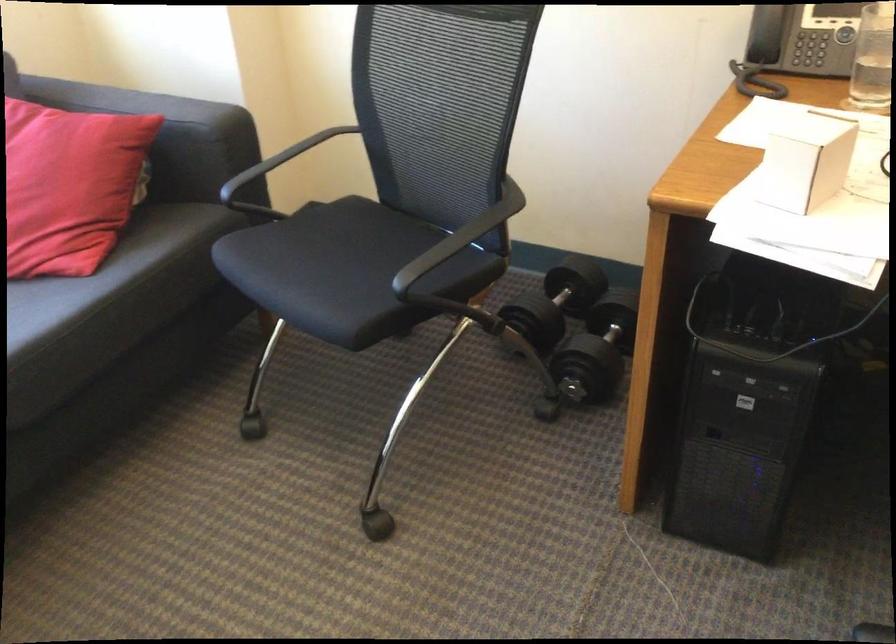
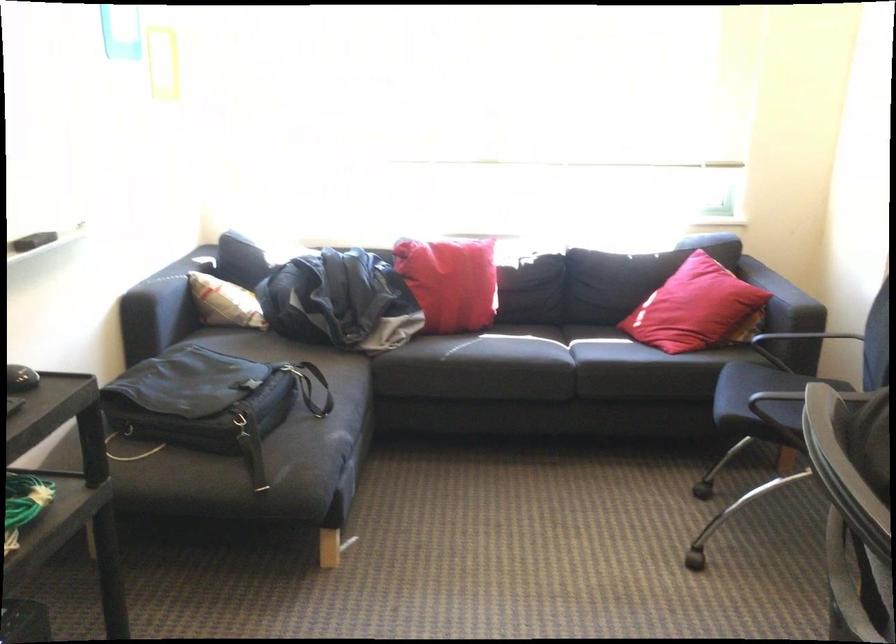
The point at (171, 126) is marked in the first image. Where is the corresponding point in the second image?

(782, 298)